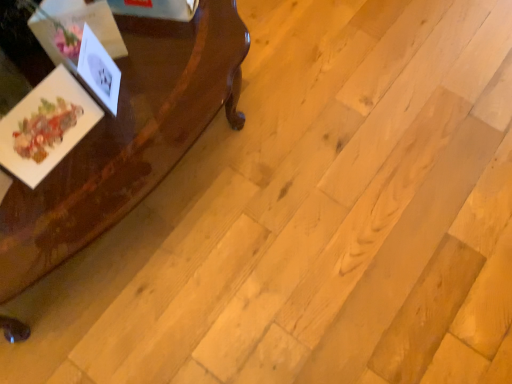
You are a GUI agent. You are given a task and a screenshot of the screen. Output one action in this format:
    pyautogui.click(x=<x>, y=<y>)
    Task: Click on the free area behind white paper at left, which appears as the 2th postcard when viewed from the left
    Image resolution: width=512 pixels, height=384 pixels.
    Given the screenshot: What is the action you would take?
    pyautogui.click(x=142, y=46)